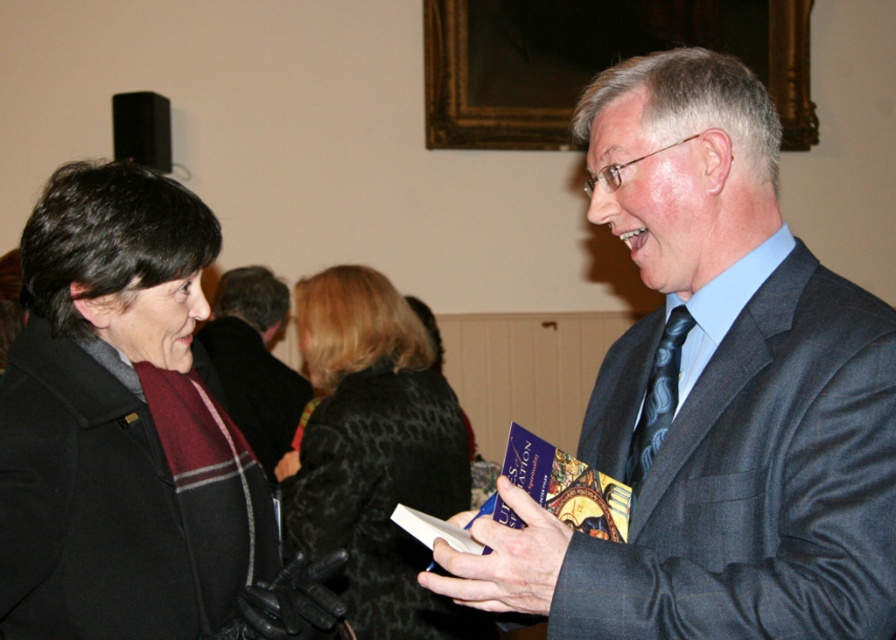
You are at a formal event and need to approach the person in the dark gray suit at center and the dark gray suit at right. Based on their positions, which one is closer to you?

The dark gray suit at center is closer to you because it is positioned in front of the dark gray suit at right.

Based on the scene description, where is the dark gray suit at center located in terms of coordinates?

Answer: The dark gray suit at center is located at coordinates point (x=713, y=396).